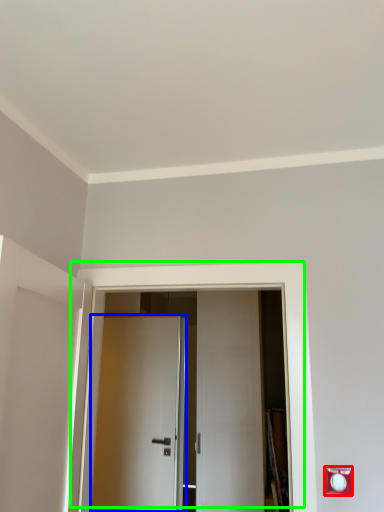
Question: Based on their relative distances, which object is farther from electric outlet (highlighted by a red box)? Choose from door (highlighted by a blue box) and door (highlighted by a green box).

Choices:
 (A) door
 (B) door

Answer: (A)